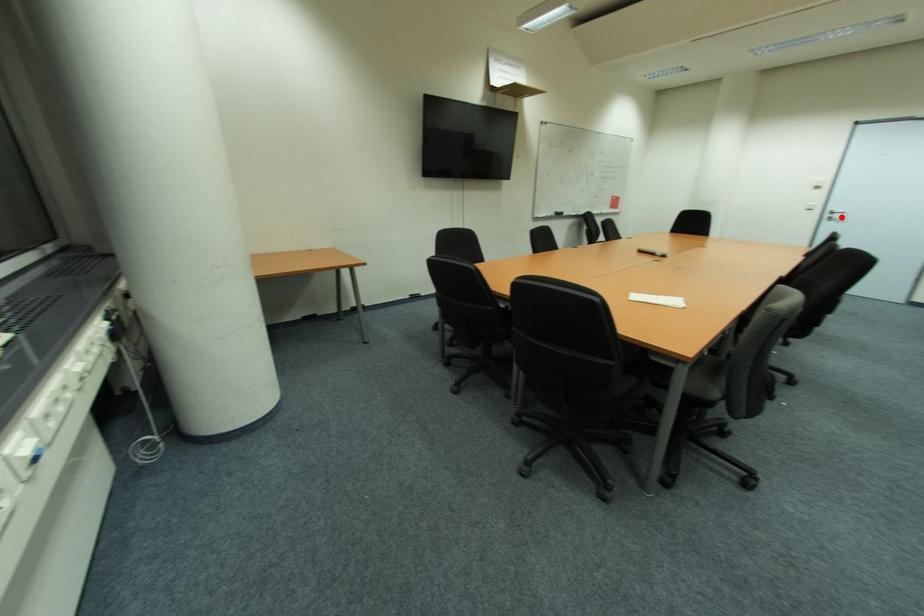
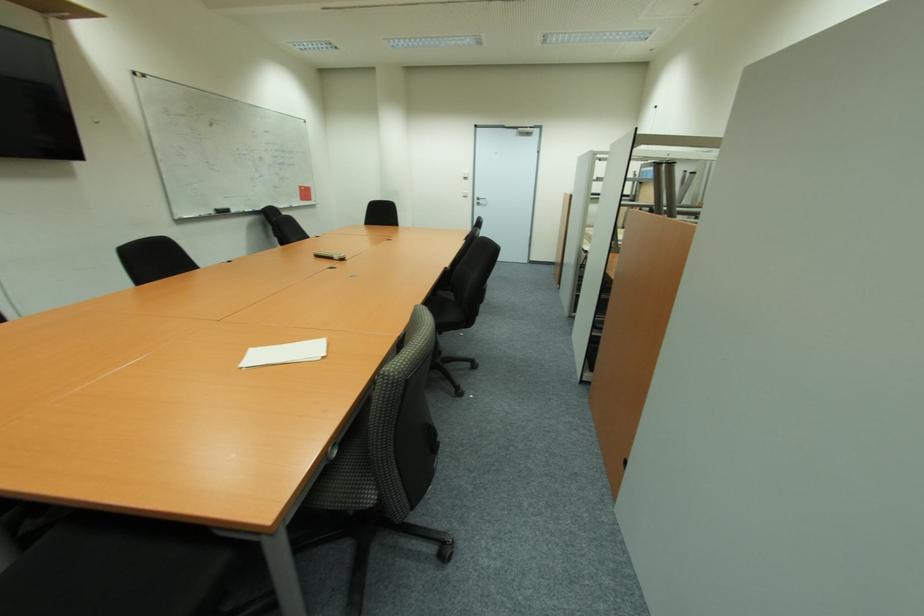
In the second image, find the point that corresponds to the highlighted location in the first image.

(483, 203)